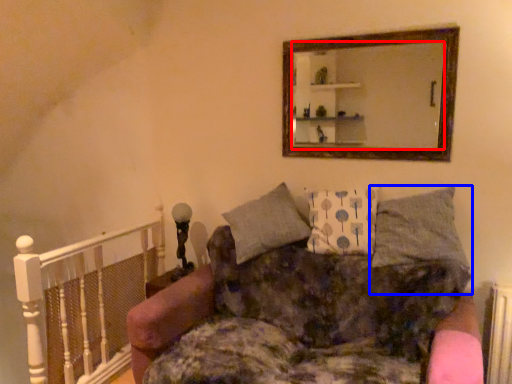
Question: Which point is closer to the camera, mirror (highlighted by a red box) or pillow (highlighted by a blue box)?

Choices:
 (A) mirror
 (B) pillow

Answer: (B)